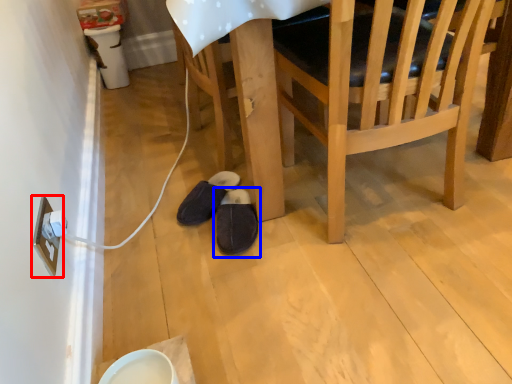
Question: Which of the following is the farthest to the observer, electric outlet (highlighted by a red box) or footwear (highlighted by a blue box)?

Choices:
 (A) electric outlet
 (B) footwear

Answer: (B)